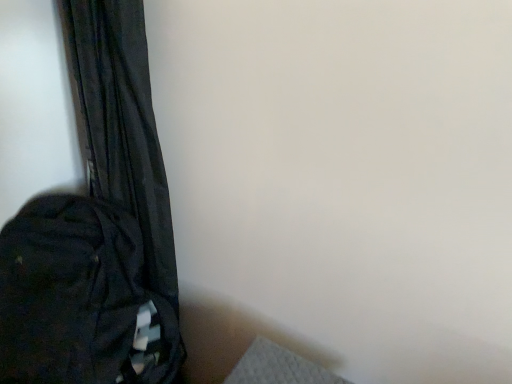
Locate an element on the screen. black fabric backpack at lower left is located at coordinates (81, 299).

In order to face black fabric backpack at lower left, should I rotate leftwards or rightwards?

To align with it, rotate left about 23.152°.

What do you see at coordinates (81, 299) in the screenshot? This screenshot has width=512, height=384. I see `black fabric backpack at lower left` at bounding box center [81, 299].

Measure the distance between black fabric curtain at left and camera.

black fabric curtain at left and camera are 76.93 centimeters apart.

What do you see at coordinates (122, 122) in the screenshot? This screenshot has height=384, width=512. I see `black fabric curtain at left` at bounding box center [122, 122].

Based on the photo, what is the approximate width of black fabric curtain at left?

black fabric curtain at left is 5.44 inches in width.

This screenshot has width=512, height=384. In order to click on black fabric curtain at left in this screenshot , I will do `click(122, 122)`.

I want to click on black fabric backpack at lower left, so pyautogui.click(x=81, y=299).

Does black fabric backpack at lower left appear on the left side of black fabric curtain at left?

Indeed, black fabric backpack at lower left is positioned on the left side of black fabric curtain at left.

Which object is further away from the camera taking this photo, black fabric backpack at lower left or black fabric curtain at left?

black fabric curtain at left is behind.

Which is closer, (x=73, y=287) or (x=96, y=105)?

The point (x=96, y=105) is more forward.

From the image's perspective, between black fabric backpack at lower left and black fabric curtain at left, who is located below?

black fabric backpack at lower left.

From a real-world perspective, between black fabric backpack at lower left and black fabric curtain at left, who is vertically lower?

From a 3D spatial view, black fabric backpack at lower left is below.

Which of these two, black fabric backpack at lower left or black fabric curtain at left, is thinner?

black fabric curtain at left is thinner.

Considering the relative sizes of black fabric backpack at lower left and black fabric curtain at left in the image provided, is black fabric backpack at lower left shorter than black fabric curtain at left?

Correct, black fabric backpack at lower left is not as tall as black fabric curtain at left.

Between black fabric backpack at lower left and black fabric curtain at left, which one has larger size?

black fabric backpack at lower left is bigger.

Choose the correct answer: Is black fabric backpack at lower left inside black fabric curtain at left or outside it?

black fabric backpack at lower left is not enclosed by black fabric curtain at left.

Can you see black fabric backpack at lower left touching black fabric curtain at left?

No, black fabric backpack at lower left is not in contact with black fabric curtain at left.

Is black fabric backpack at lower left oriented away from black fabric curtain at left?

Absolutely, black fabric backpack at lower left is directed away from black fabric curtain at left.

Consider the image. Can you tell me how much black fabric backpack at lower left and black fabric curtain at left differ in facing direction?

The angular difference between black fabric backpack at lower left and black fabric curtain at left is 0.000122 degrees.

Identify the location of backpack located below the black fabric curtain at left (from the image's perspective). This screenshot has height=384, width=512. (x=81, y=299).

Considering the positions of objects black fabric curtain at left and black fabric backpack at lower left in the image provided, who is more to the right, black fabric curtain at left or black fabric backpack at lower left?

From the viewer's perspective, black fabric curtain at left appears more on the right side.

Which object is more forward, black fabric curtain at left or black fabric backpack at lower left?

Positioned in front is black fabric backpack at lower left.

Considering the points (157, 159) and (179, 332), which point is in front, point (157, 159) or point (179, 332)?

The point (157, 159) is closer.

From the image's perspective, is black fabric curtain at left under black fabric backpack at lower left?

No.

From a real-world perspective, is black fabric curtain at left physically above black fabric backpack at lower left?

Indeed, from a real-world perspective, black fabric curtain at left stands above black fabric backpack at lower left.

Looking at their sizes, would you say black fabric curtain at left is wider or thinner than black fabric backpack at lower left?

black fabric curtain at left is thinner than black fabric backpack at lower left.

Considering the sizes of black fabric curtain at left and black fabric backpack at lower left in the image, is black fabric curtain at left taller or shorter than black fabric backpack at lower left?

Considering their sizes, black fabric curtain at left has more height than black fabric backpack at lower left.

Can you confirm if black fabric curtain at left is smaller than black fabric backpack at lower left?

Yes.

Is black fabric curtain at left surrounding black fabric backpack at lower left?

No, black fabric backpack at lower left is not inside black fabric curtain at left.

Is black fabric curtain at left positioned far away from black fabric backpack at lower left?

They are positioned close to each other.

Does black fabric curtain at left turn towards black fabric backpack at lower left?

Yes, black fabric curtain at left faces towards black fabric backpack at lower left.

How many degrees apart are the facing directions of black fabric curtain at left and black fabric backpack at lower left?

Answer: The angle between the facing direction of black fabric curtain at left and the facing direction of black fabric backpack at lower left is 0.000122 degrees.

Measure the distance between black fabric curtain at left and black fabric backpack at lower left.

They are 6.52 inches apart.

Image resolution: width=512 pixels, height=384 pixels. Find the location of `curtain behind the black fabric backpack at lower left`. curtain behind the black fabric backpack at lower left is located at coordinates (122, 122).

Where is `curtain behind the black fabric backpack at lower left`? The width and height of the screenshot is (512, 384). curtain behind the black fabric backpack at lower left is located at coordinates (122, 122).

Find the location of a particular element. The width and height of the screenshot is (512, 384). backpack that appears on the left of black fabric curtain at left is located at coordinates (81, 299).